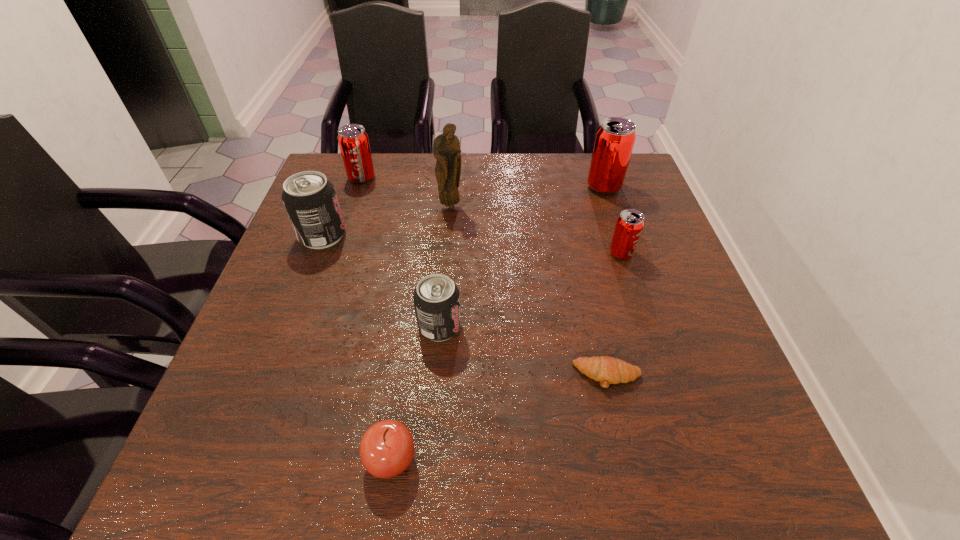
In order to click on the tallest object in this screenshot , I will do `click(446, 147)`.

Where is `the sixth nearest object`? This screenshot has height=540, width=960. the sixth nearest object is located at coordinates (446, 147).

The height and width of the screenshot is (540, 960). I want to click on the tallest soda can, so click(x=615, y=138).

Find the location of `the seventh shortest object`. the seventh shortest object is located at coordinates (615, 138).

The height and width of the screenshot is (540, 960). What are the coordinates of `the leftmost red soda can` in the screenshot? It's located at (353, 140).

At what (x,y) coordinates should I click in order to perform the action: click on the farther black soda can. Please return your answer as a coordinate pair (x, y). Looking at the image, I should click on (310, 200).

Where is `the bigger black soda can`? This screenshot has height=540, width=960. the bigger black soda can is located at coordinates (310, 200).

Locate an element on the screen. Image resolution: width=960 pixels, height=540 pixels. the nearest red soda can is located at coordinates (630, 223).

The width and height of the screenshot is (960, 540). Identify the location of the third nearest object. (436, 298).

This screenshot has width=960, height=540. Identify the location of the third soda can from left to right. (436, 298).